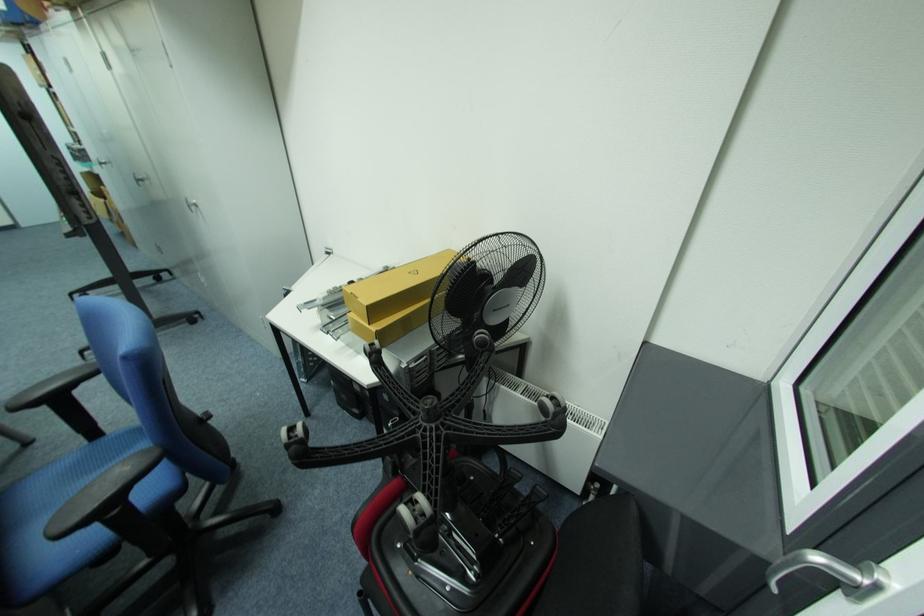
Describe the element at coordinates (38, 500) in the screenshot. This screenshot has width=924, height=616. I see `the blue chair sitting surface` at that location.